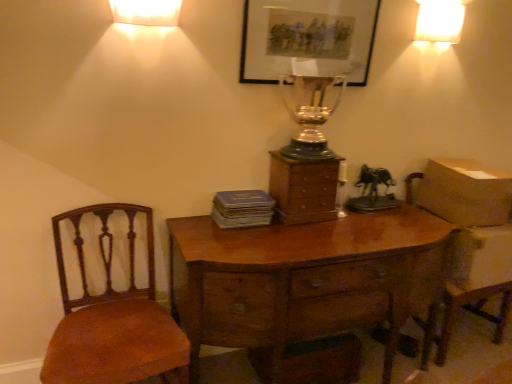
What are the coordinates of `vacant area to the right of matte gray book at center` in the screenshot? It's located at (288, 233).